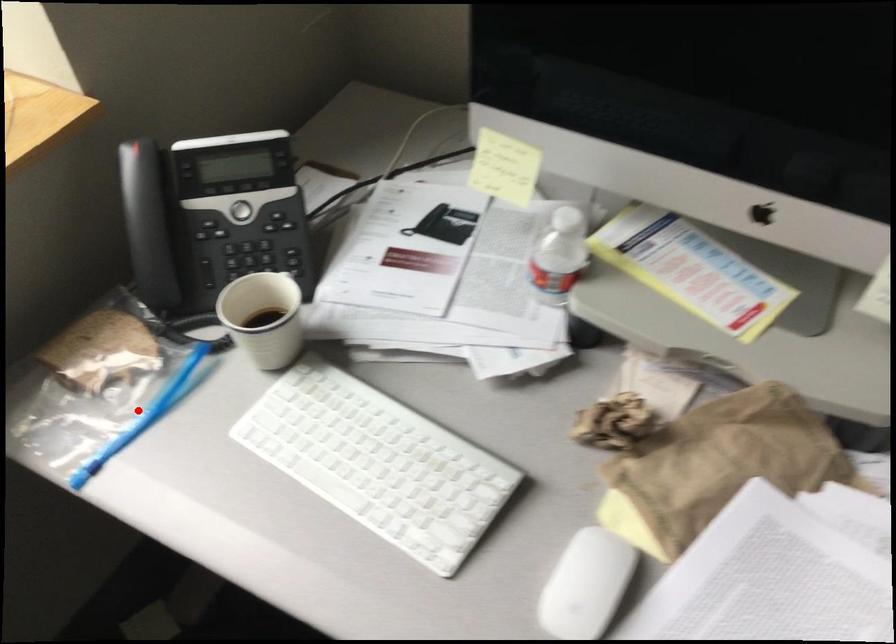
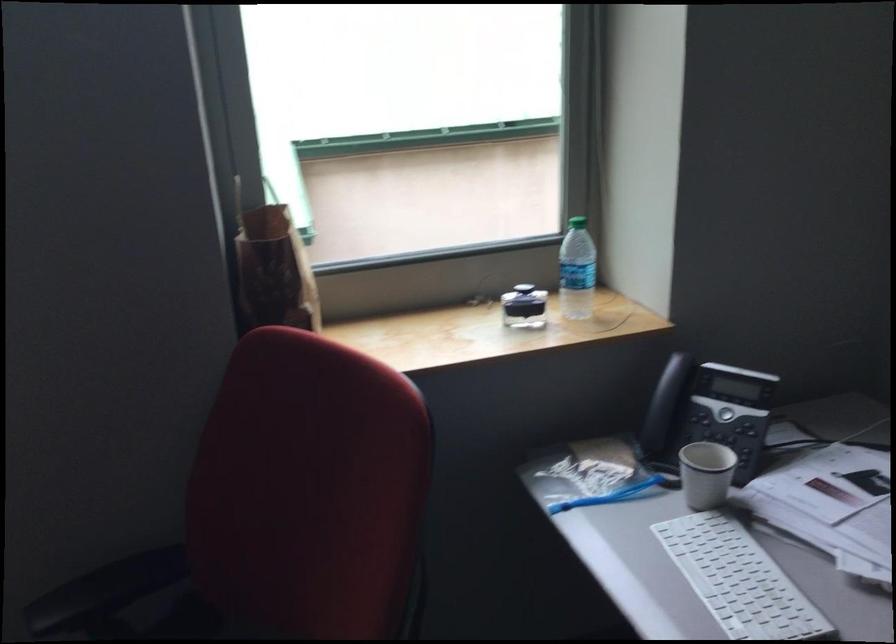
Find the pixel in the second image that matches the highlighted location in the first image.

(607, 495)